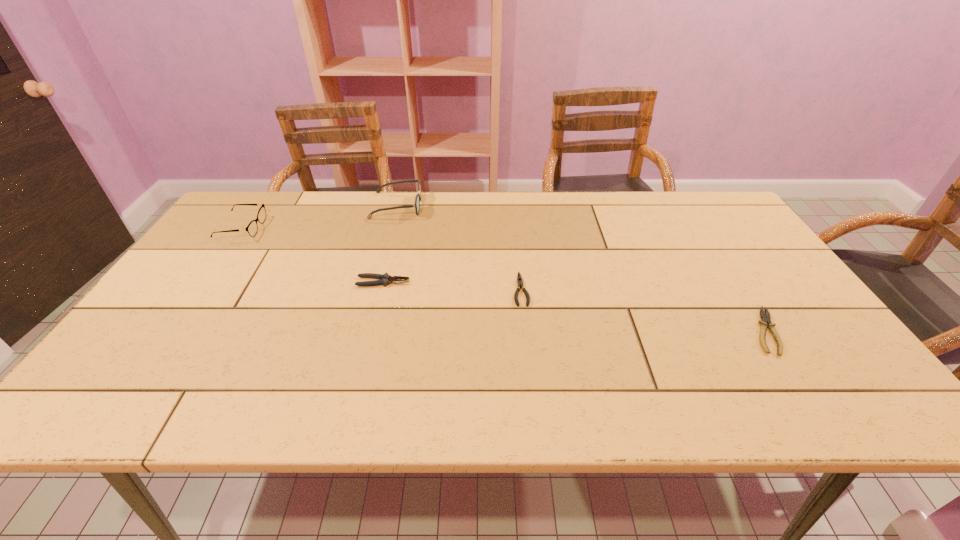
Identify the location of vacant point located between the leftmost object and the second object from right to left. (381, 259).

Image resolution: width=960 pixels, height=540 pixels. Identify the location of object that can be found as the closest to the leftmost pliers. (418, 197).

Identify which object is located as the second nearest to the leftmost pliers. Please provide its 2D coordinates. Your answer should be formatted as a tuple, i.e. [(x, y)], where the tuple contains the x and y coordinates of a point satisfying the conditions above.

[(519, 279)]

Locate an element on the screen. Image resolution: width=960 pixels, height=540 pixels. pliers that is the second closest one to the rightmost pliers is located at coordinates (385, 279).

Select which pliers is the second closest to the leftmost object. Please provide its 2D coordinates. Your answer should be formatted as a tuple, i.e. [(x, y)], where the tuple contains the x and y coordinates of a point satisfying the conditions above.

[(519, 279)]

You are a GUI agent. You are given a task and a screenshot of the screen. Output one action in this format:
    pyautogui.click(x=<x>, y=<y>)
    Task: Click on the free space that satisfies the following two spatial constraints: 1. on the back side of the second pliers from left to right; 2. at the gripping part of the tallest pliers
    This screenshot has width=960, height=540.
    Given the screenshot: What is the action you would take?
    pyautogui.click(x=520, y=282)

The image size is (960, 540). In order to click on free space that satisfies the following two spatial constraints: 1. on the face of the right spectacles; 2. on the right side of the second pliers from right to left in this screenshot , I will do `click(374, 289)`.

What are the coordinates of `free space that satisfies the following two spatial constraints: 1. on the face of the right spectacles; 2. on the left side of the nearest pliers` in the screenshot? It's located at (364, 332).

This screenshot has width=960, height=540. I want to click on free point that satisfies the following two spatial constraints: 1. on the front side of the rightmost pliers; 2. on the right side of the second pliers from left to right, so click(x=525, y=332).